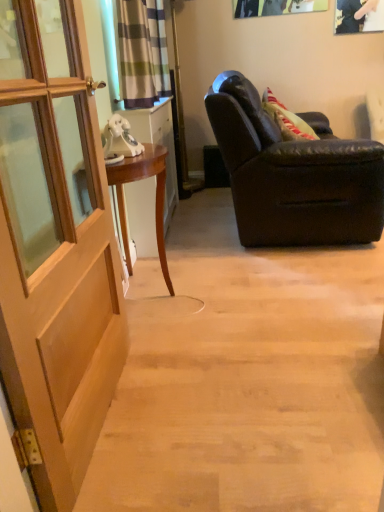
Question: Can you confirm if striped fabric curtain at upper center is taller than mahogany wood desk at left?

Choices:
 (A) yes
 (B) no

Answer: (B)

Question: Does striped fabric curtain at upper center touch mahogany wood desk at left?

Choices:
 (A) no
 (B) yes

Answer: (A)

Question: Can you confirm if striped fabric curtain at upper center is positioned to the left of mahogany wood desk at left?

Choices:
 (A) no
 (B) yes

Answer: (B)

Question: From the image's perspective, would you say striped fabric curtain at upper center is shown under mahogany wood desk at left?

Choices:
 (A) yes
 (B) no

Answer: (B)

Question: Does striped fabric curtain at upper center have a lesser width compared to mahogany wood desk at left?

Choices:
 (A) no
 (B) yes

Answer: (B)

Question: From the image's perspective, is mahogany wood desk at left located above or below matte white cabinet at left?

Choices:
 (A) above
 (B) below

Answer: (B)

Question: Choose the correct answer: Is mahogany wood desk at left inside matte white cabinet at left or outside it?

Choices:
 (A) inside
 (B) outside

Answer: (B)

Question: In the image, is mahogany wood desk at left on the left side or the right side of matte white cabinet at left?

Choices:
 (A) right
 (B) left

Answer: (A)

Question: From a real-world perspective, relative to matte white cabinet at left, is mahogany wood desk at left vertically above or below?

Choices:
 (A) above
 (B) below

Answer: (B)

Question: Considering the relative positions of matte black leather armchair at right and mahogany wood desk at left in the image provided, is matte black leather armchair at right to the left or to the right of mahogany wood desk at left?

Choices:
 (A) left
 (B) right

Answer: (B)

Question: From the image's perspective, relative to mahogany wood desk at left, is matte black leather armchair at right above or below?

Choices:
 (A) above
 (B) below

Answer: (A)

Question: From a real-world perspective, is matte black leather armchair at right physically located above or below mahogany wood desk at left?

Choices:
 (A) above
 (B) below

Answer: (A)

Question: Is point (326, 145) positioned closer to the camera than point (142, 175)?

Choices:
 (A) closer
 (B) farther

Answer: (B)

Question: From the image's perspective, is striped fabric curtain at upper center positioned above or below velvet-like green pillow at right?

Choices:
 (A) above
 (B) below

Answer: (A)

Question: Is striped fabric curtain at upper center in front of or behind velvet-like green pillow at right in the image?

Choices:
 (A) front
 (B) behind

Answer: (A)